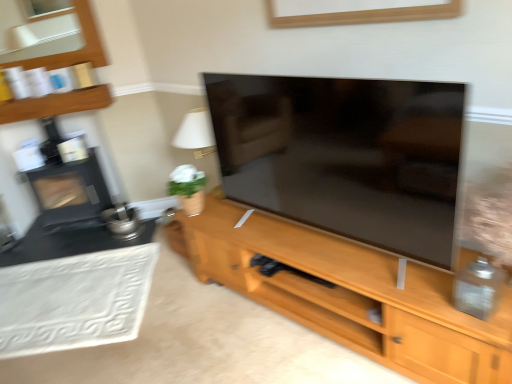
The height and width of the screenshot is (384, 512). Identify the location of blank space situated above wooden cabinet at center (from a real-world perspective). (169, 318).